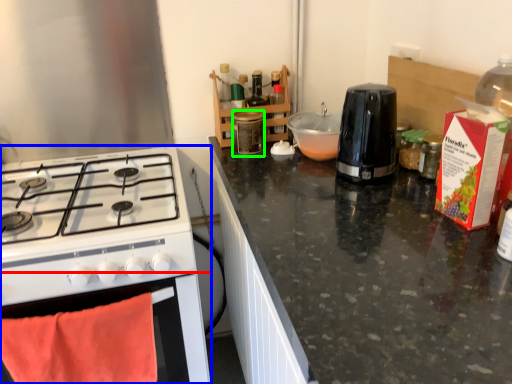
Question: Estimate the real-world distances between objects in this image. Which object is farther from oven (highlighted by a red box), kitchen appliance (highlighted by a blue box) or bottle (highlighted by a green box)?

Choices:
 (A) kitchen appliance
 (B) bottle

Answer: (B)